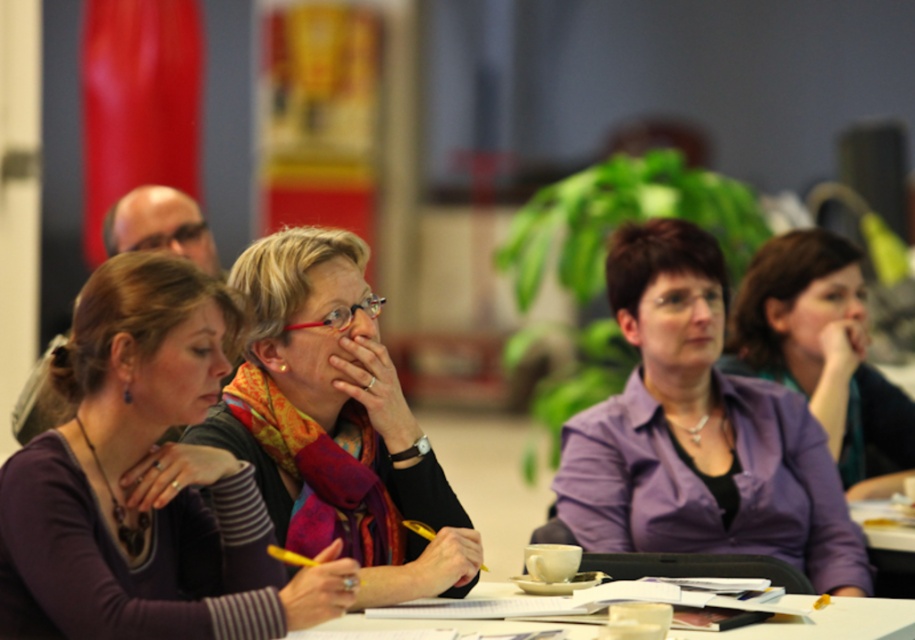
You are standing in front of the meeting table and want to reach a point that is exactly 2.48 meters away from you. Can you confirm if the point at coordinates point (338, 442) is exactly at that distance?

The distance of point (338, 442) from the viewer is exactly 2.48 meters, so yes, the point at coordinates point (338, 442) is exactly 2.48 meters away from you.

You are standing in front of the meeting table and want to place a small object on the table. You have two options for placement based on coordinates given in the image. The first option is at point (82, 460) and the second is at point (881, 632). Considering the perspective of the image, which point is closer to you?

Point (82, 460) is closer to the viewer than point (881, 632) based on the image perspective.

In the scene described, where is the matte purple shirt at center located in terms of coordinates?

The matte purple shirt at center is located at coordinates point (126,490).